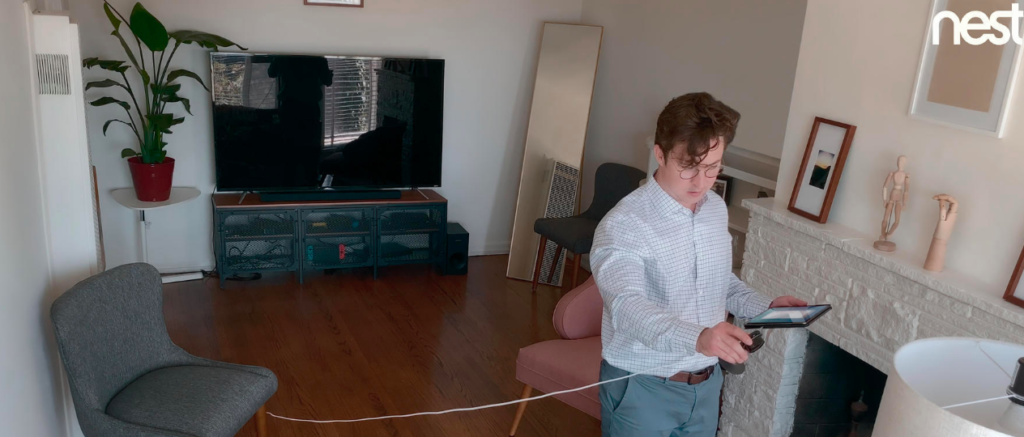
The height and width of the screenshot is (437, 1024). Find the location of `door`. door is located at coordinates (74, 124).